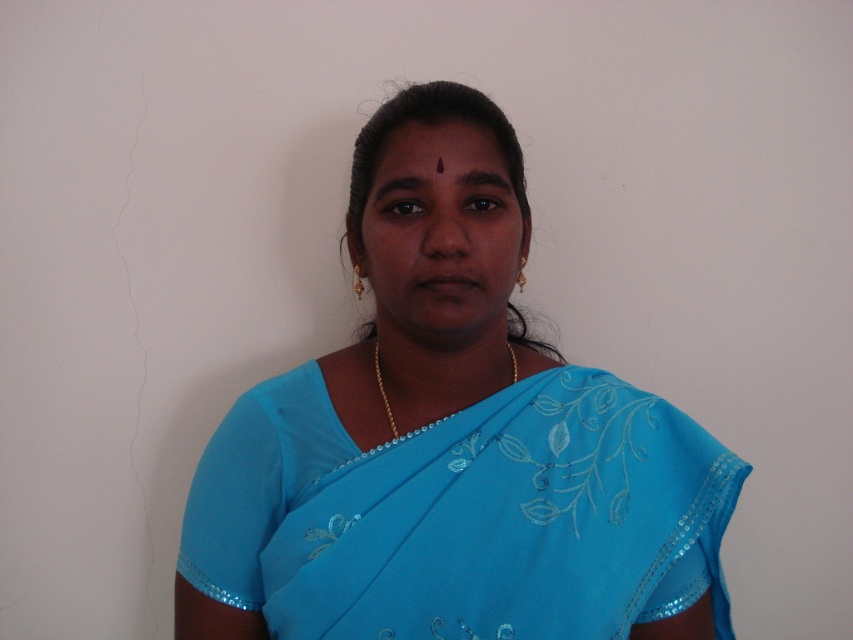
Consider the image. Between blue silk saree at center and gold chain at center, which one is positioned lower?

blue silk saree at center is below.

Does blue silk saree at center have a larger size compared to gold chain at center?

Yes.

The width and height of the screenshot is (853, 640). What do you see at coordinates (451, 440) in the screenshot?
I see `blue silk saree at center` at bounding box center [451, 440].

What are the coordinates of `blue silk saree at center` in the screenshot? It's located at (451, 440).

Between blue satin saree at center and gold chain at center, which one has more height?

blue satin saree at center is taller.

Can you confirm if blue satin saree at center is taller than gold chain at center?

Indeed, blue satin saree at center has a greater height compared to gold chain at center.

The image size is (853, 640). Find the location of `blue satin saree at center`. blue satin saree at center is located at coordinates (462, 515).

Does blue silk saree at center have a smaller size compared to blue satin saree at center?

Actually, blue silk saree at center might be larger than blue satin saree at center.

Which is behind, point (549, 560) or point (521, 404)?

The point (521, 404) is behind.

Does point (555, 556) come closer to viewer compared to point (297, 572)?

Yes, it is in front of point (297, 572).

This screenshot has height=640, width=853. What are the coordinates of `blue silk saree at center` in the screenshot? It's located at (451, 440).